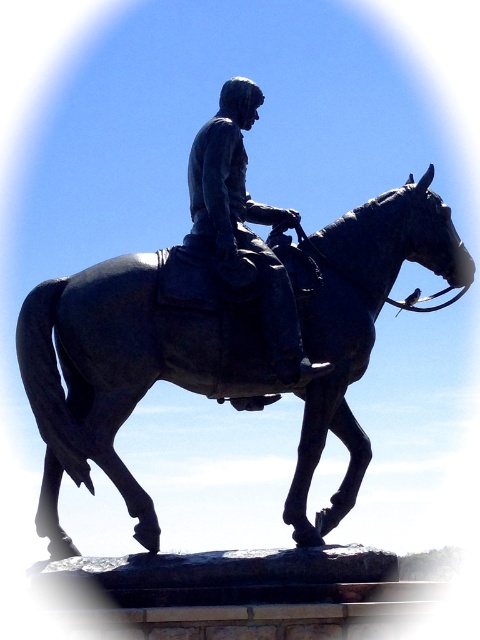
Where is `bronze statue of horse at center`? Image resolution: width=480 pixels, height=640 pixels. bronze statue of horse at center is located at coordinates (219, 352).

Locate an element on the screen. The width and height of the screenshot is (480, 640). bronze statue of horse at center is located at coordinates (219, 352).